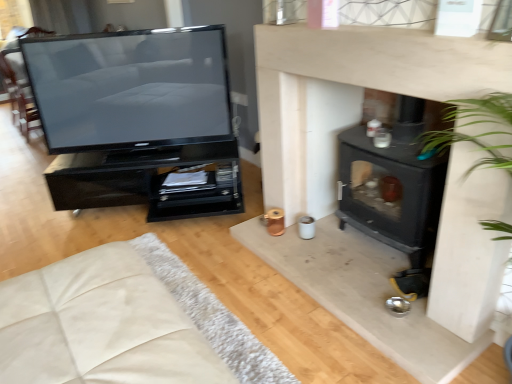
You are a GUI agent. You are given a task and a screenshot of the screen. Output one action in this format:
    pyautogui.click(x=<x>, y=<y>)
    Task: Click on the vacant space situated on the left part of black matte wood burning stove at center-right
    This screenshot has height=384, width=512.
    Given the screenshot: What is the action you would take?
    pyautogui.click(x=308, y=258)